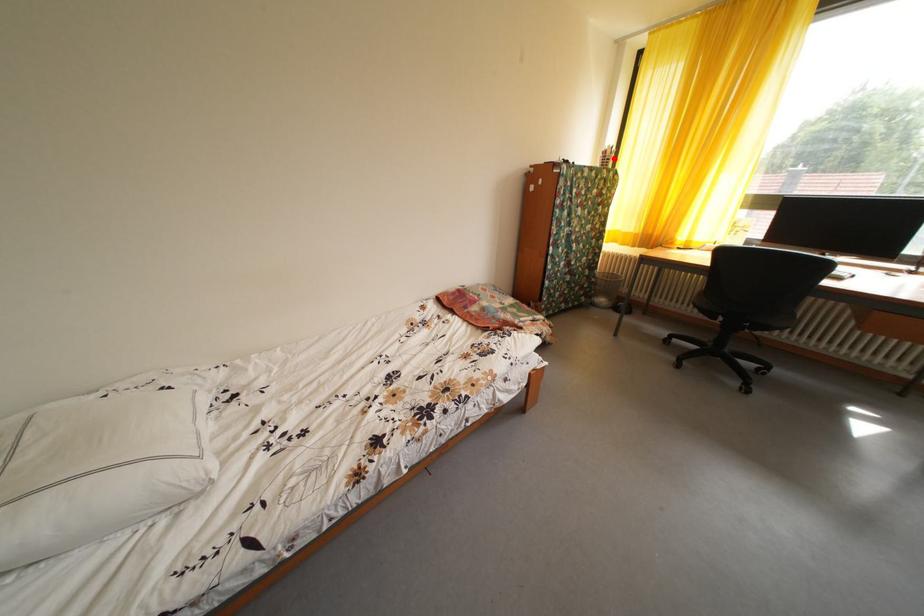
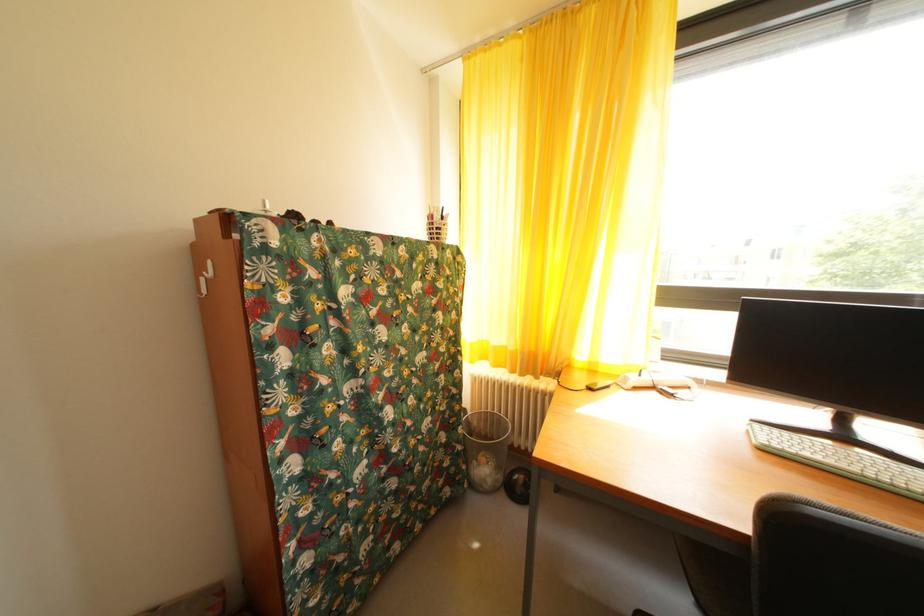
Locate, in the second image, the point that corresponds to the highlighted location in the first image.

(440, 223)